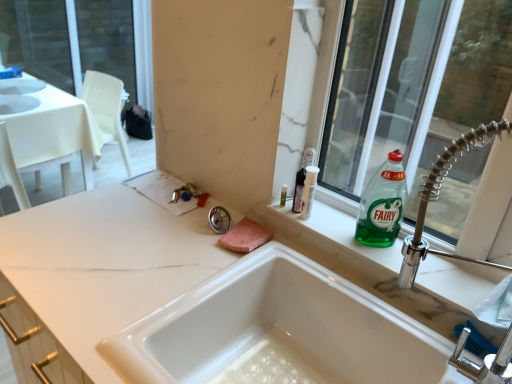
Where is `vacant space to the right of translucent plastic bottle at upper right`? This screenshot has height=384, width=512. vacant space to the right of translucent plastic bottle at upper right is located at coordinates (341, 225).